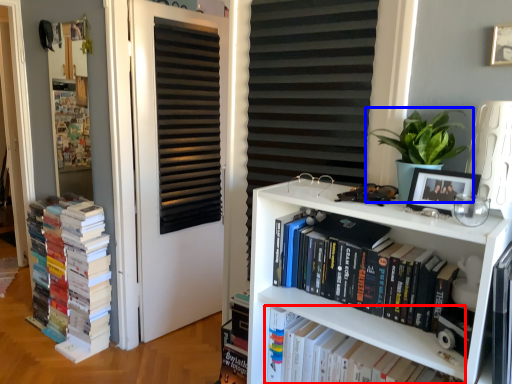
Question: Which of the following is the closest to the observer, book (highlighted by a red box) or houseplant (highlighted by a blue box)?

Choices:
 (A) book
 (B) houseplant

Answer: (B)